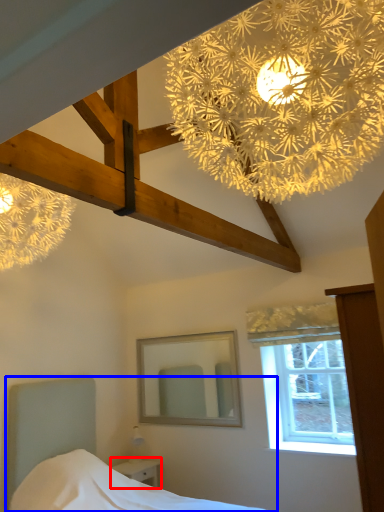
Question: Which point is further to the camera, nightstand (highlighted by a red box) or bed (highlighted by a blue box)?

Choices:
 (A) nightstand
 (B) bed

Answer: (A)